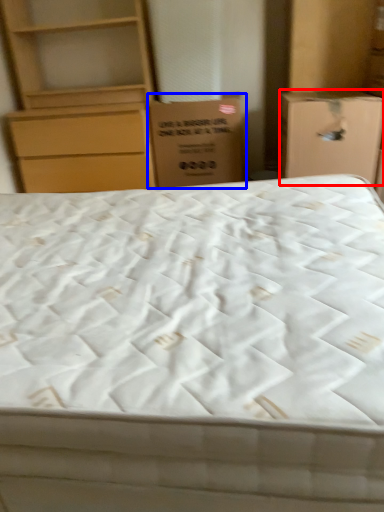
Question: Which of the following is the farthest to the observer, cardboard box (highlighted by a red box) or cardboard box (highlighted by a blue box)?

Choices:
 (A) cardboard box
 (B) cardboard box

Answer: (B)